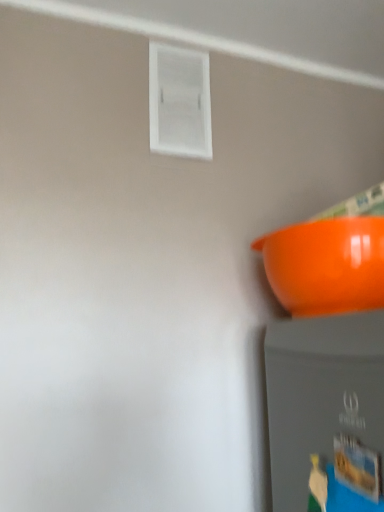
Describe the element at coordinates (179, 102) in the screenshot. Image resolution: width=384 pixels, height=512 pixels. I see `white plastic window at upper center` at that location.

Locate an element on the screen. This screenshot has height=512, width=384. white plastic window at upper center is located at coordinates (179, 102).

Where is `glossy plastic bowl at right`? glossy plastic bowl at right is located at coordinates (326, 265).

Describe the element at coordinates (326, 265) in the screenshot. I see `glossy plastic bowl at right` at that location.

The width and height of the screenshot is (384, 512). I want to click on white plastic window at upper center, so click(x=179, y=102).

Considering the relative positions of glossy plastic bowl at right and white plastic window at upper center in the image provided, is glossy plastic bowl at right to the left of white plastic window at upper center from the viewer's perspective?

No.

Does glossy plastic bowl at right come behind white plastic window at upper center?

No, glossy plastic bowl at right is closer to the camera.

Between point (355, 229) and point (199, 63), which one is positioned in front?

The point (355, 229) is closer to the camera.

From the image's perspective, which one is positioned higher, glossy plastic bowl at right or white plastic window at upper center?

white plastic window at upper center, from the image's perspective.

From a real-world perspective, which is physically above, glossy plastic bowl at right or white plastic window at upper center?

white plastic window at upper center, from a real-world perspective.

Which object is wider, glossy plastic bowl at right or white plastic window at upper center?

glossy plastic bowl at right is wider.

From the picture: Considering the relative sizes of glossy plastic bowl at right and white plastic window at upper center in the image provided, is glossy plastic bowl at right shorter than white plastic window at upper center?

Yes.

Which of these two, glossy plastic bowl at right or white plastic window at upper center, is smaller?

white plastic window at upper center is smaller.

Is glossy plastic bowl at right positioned beyond the bounds of white plastic window at upper center?

Yes, glossy plastic bowl at right is located beyond the bounds of white plastic window at upper center.

Is glossy plastic bowl at right placed right next to white plastic window at upper center?

glossy plastic bowl at right and white plastic window at upper center are clearly separated.

Could you tell me if glossy plastic bowl at right is facing white plastic window at upper center?

No, glossy plastic bowl at right is not facing towards white plastic window at upper center.

The width and height of the screenshot is (384, 512). Find the location of `window on the left side of glossy plastic bowl at right`. window on the left side of glossy plastic bowl at right is located at coordinates (179, 102).

Is white plastic window at upper center at the left side of glossy plastic bowl at right?

Correct, you'll find white plastic window at upper center to the left of glossy plastic bowl at right.

Is the position of white plastic window at upper center less distant than that of glossy plastic bowl at right?

No, white plastic window at upper center is behind glossy plastic bowl at right.

Between point (190, 113) and point (312, 266), which one is positioned behind?

The point (190, 113) is farther.

From the image's perspective, is white plastic window at upper center located beneath glossy plastic bowl at right?

No, from the image's perspective, white plastic window at upper center is not beneath glossy plastic bowl at right.

From a real-world perspective, is white plastic window at upper center physically above glossy plastic bowl at right?

Yes, from a real-world perspective, white plastic window at upper center is above glossy plastic bowl at right.

Which object is thinner, white plastic window at upper center or glossy plastic bowl at right?

With smaller width is white plastic window at upper center.

Considering the sizes of objects white plastic window at upper center and glossy plastic bowl at right in the image provided, who is taller, white plastic window at upper center or glossy plastic bowl at right?

With more height is white plastic window at upper center.

Can you confirm if white plastic window at upper center is smaller than glossy plastic bowl at right?

Correct, white plastic window at upper center occupies less space than glossy plastic bowl at right.

In the scene shown: Is glossy plastic bowl at right located within white plastic window at upper center?

Actually, glossy plastic bowl at right is outside white plastic window at upper center.

Are white plastic window at upper center and glossy plastic bowl at right far apart?

No, white plastic window at upper center is not far from glossy plastic bowl at right.

Based on the photo, is white plastic window at upper center facing towards glossy plastic bowl at right?

No, white plastic window at upper center does not turn towards glossy plastic bowl at right.

How different are the orientations of white plastic window at upper center and glossy plastic bowl at right in degrees?

The angle between the facing direction of white plastic window at upper center and the facing direction of glossy plastic bowl at right is 90 degrees.

How much distance is there between white plastic window at upper center and glossy plastic bowl at right?

white plastic window at upper center is 16.80 inches away from glossy plastic bowl at right.

I want to click on bowl located in front of the white plastic window at upper center, so click(326, 265).

Where is `bowl on the right of white plastic window at upper center`? The image size is (384, 512). bowl on the right of white plastic window at upper center is located at coordinates (326, 265).

This screenshot has height=512, width=384. In the image, there is a white plastic window at upper center. Identify the location of bowl below it (from a real-world perspective). (326, 265).